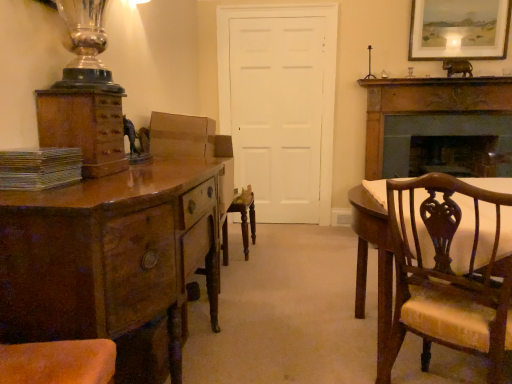
Find the location of a particular element. The image size is (512, 384). shiny brown wood chest of drawers at left is located at coordinates 110,254.

The image size is (512, 384). What do you see at coordinates (110, 254) in the screenshot?
I see `shiny brown wood chest of drawers at left` at bounding box center [110, 254].

Identify the location of wooden carved chair at right. (450, 268).

The width and height of the screenshot is (512, 384). Describe the element at coordinates (84, 127) in the screenshot. I see `brown wood cabinet at left` at that location.

Image resolution: width=512 pixels, height=384 pixels. Describe the element at coordinates (429, 115) in the screenshot. I see `dark brown wood fireplace at right` at that location.

The height and width of the screenshot is (384, 512). I want to click on metallic silver book at left, so click(39, 168).

From the image's perspective, is white matte door at center above or below metallic silver book at left?

Clearly, from the image's perspective, white matte door at center is above metallic silver book at left.

Can you confirm if white matte door at center is positioned to the left of metallic silver book at left?

No.

Can you tell me how much white matte door at center and metallic silver book at left differ in facing direction?

They differ by 85.9 degrees in their facing directions.

Based on the photo, does brown wood cabinet at left turn towards dark brown wood fireplace at right?

No, brown wood cabinet at left is not aimed at dark brown wood fireplace at right.

Would you consider brown wood cabinet at left to be distant from dark brown wood fireplace at right?

Yes.

Considering the positions of point (78, 93) and point (509, 134), is point (78, 93) closer or farther from the camera than point (509, 134)?

Point (78, 93) is closer to the camera than point (509, 134).

Between brown wood cabinet at left and dark brown wood fireplace at right, which one is positioned in front?

brown wood cabinet at left is closer to the camera.

In the image, is metallic silver book at left on the left side or the right side of dark brown wood fireplace at right?

Clearly, metallic silver book at left is on the left of dark brown wood fireplace at right in the image.

Find the location of a particular element. Image resolution: width=512 pixels, height=384 pixels. book on the left of dark brown wood fireplace at right is located at coordinates pos(39,168).

From their relative heights in the image, would you say metallic silver book at left is taller or shorter than dark brown wood fireplace at right?

Clearly, metallic silver book at left is shorter compared to dark brown wood fireplace at right.

Locate an element on the screen. chair lying below the matte white picture frame at upper right (from the image's perspective) is located at coordinates (450, 268).

Is wooden carved chair at right completely or partially outside of matte white picture frame at upper right?

Yes, wooden carved chair at right is not within matte white picture frame at upper right.

Which point is more distant from viewer, [481,262] or [438,39]?

The point [438,39] is farther from the camera.

From the picture: Considering the positions of objects wooden carved chair at right and matte white picture frame at upper right in the image provided, who is in front, wooden carved chair at right or matte white picture frame at upper right?

wooden carved chair at right is in front.

From the image's perspective, is brown wood cabinet at left above wooden carved chair at right?

Indeed, from the image's perspective, brown wood cabinet at left is shown above wooden carved chair at right.

From a real-world perspective, is brown wood cabinet at left physically below wooden carved chair at right?

No, from a real-world perspective, brown wood cabinet at left is not under wooden carved chair at right.

Is brown wood cabinet at left wider than wooden carved chair at right?

No, brown wood cabinet at left is not wider than wooden carved chair at right.

Considering the positions of point (82, 144) and point (420, 291), is point (82, 144) closer or farther from the camera than point (420, 291)?

Point (82, 144).

Who is smaller, brown wood cabinet at left or shiny brown wood chest of drawers at left?

brown wood cabinet at left.

Find the location of `cabinetry on the left of shiny brown wood chest of drawers at left`. cabinetry on the left of shiny brown wood chest of drawers at left is located at coordinates [84, 127].

Visually, is brown wood cabinet at left positioned to the left or to the right of shiny brown wood chest of drawers at left?

Clearly, brown wood cabinet at left is on the left of shiny brown wood chest of drawers at left in the image.

From the image's perspective, is brown wood cabinet at left over shiny brown wood chest of drawers at left?

Indeed, from the image's perspective, brown wood cabinet at left is shown above shiny brown wood chest of drawers at left.

Is dark brown wood fireplace at right touching matte white picture frame at upper right?

No, dark brown wood fireplace at right is not beside matte white picture frame at upper right.

Considering the sizes of dark brown wood fireplace at right and matte white picture frame at upper right in the image, is dark brown wood fireplace at right taller or shorter than matte white picture frame at upper right?

In the image, dark brown wood fireplace at right appears to be taller than matte white picture frame at upper right.

Between dark brown wood fireplace at right and matte white picture frame at upper right, which one appears on the right side from the viewer's perspective?

matte white picture frame at upper right.

Does dark brown wood fireplace at right have a larger size compared to matte white picture frame at upper right?

Indeed, dark brown wood fireplace at right has a larger size compared to matte white picture frame at upper right.

Image resolution: width=512 pixels, height=384 pixels. What are the coordinates of `door on the right of metallic silver book at left` in the screenshot? It's located at (278, 113).

You are a GUI agent. You are given a task and a screenshot of the screen. Output one action in this format:
    pyautogui.click(x=<x>, y=<y>)
    Task: Click on the cabinetry lying below the dark brown wood fireplace at right (from the image's perspective)
    This screenshot has width=512, height=384.
    Given the screenshot: What is the action you would take?
    pyautogui.click(x=84, y=127)

Based on their spatial positions, is white matte door at center or brown wood cabinet at left further from metallic silver book at left?

Based on the image, white matte door at center appears to be further to metallic silver book at left.

Considering their positions, is metallic silver book at left positioned further to wooden carved chair at right than matte white picture frame at upper right?

matte white picture frame at upper right is positioned further to the anchor wooden carved chair at right.

Considering their positions, is metallic silver book at left positioned closer to brown wood cabinet at left than dark brown wood fireplace at right?

metallic silver book at left lies closer to brown wood cabinet at left than the other object.

Which object lies further to the anchor point matte white picture frame at upper right, brown wood cabinet at left or wooden carved chair at right?

brown wood cabinet at left is further to matte white picture frame at upper right.

Looking at the image, which one is located further to shiny brown wood chest of drawers at left, metallic silver book at left or wooden carved chair at right?

wooden carved chair at right is positioned further to the anchor shiny brown wood chest of drawers at left.

Looking at the image, which one is located further to matte white picture frame at upper right, white matte door at center or brown wood cabinet at left?

Among the two, brown wood cabinet at left is located further to matte white picture frame at upper right.

When comparing their distances from wooden carved chair at right, does white matte door at center or matte white picture frame at upper right seem further?

matte white picture frame at upper right.

Estimate the real-world distances between objects in this image. Which object is further from metallic silver book at left, white matte door at center or matte white picture frame at upper right?

matte white picture frame at upper right is further to metallic silver book at left.

At what (x,y) coordinates should I click in order to perform the action: click on cabinetry positioned between shiny brown wood chest of drawers at left and white matte door at center from near to far. Please return your answer as a coordinate pair (x, y). Looking at the image, I should click on (84, 127).

This screenshot has width=512, height=384. What are the coordinates of `picture frame located between wooden carved chair at right and white matte door at center in the depth direction` in the screenshot? It's located at (459, 29).

The width and height of the screenshot is (512, 384). I want to click on book located between wooden carved chair at right and white matte door at center in the depth direction, so click(39, 168).

The width and height of the screenshot is (512, 384). Find the location of `fireplace located between brown wood cabinet at left and matte white picture frame at upper right in the left-right direction`. fireplace located between brown wood cabinet at left and matte white picture frame at upper right in the left-right direction is located at coordinates (429, 115).